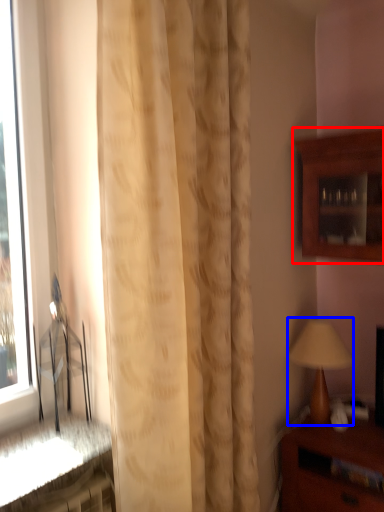
Question: Which point is further to the camera, cabinetry (highlighted by a red box) or table lamp (highlighted by a blue box)?

Choices:
 (A) cabinetry
 (B) table lamp

Answer: (B)